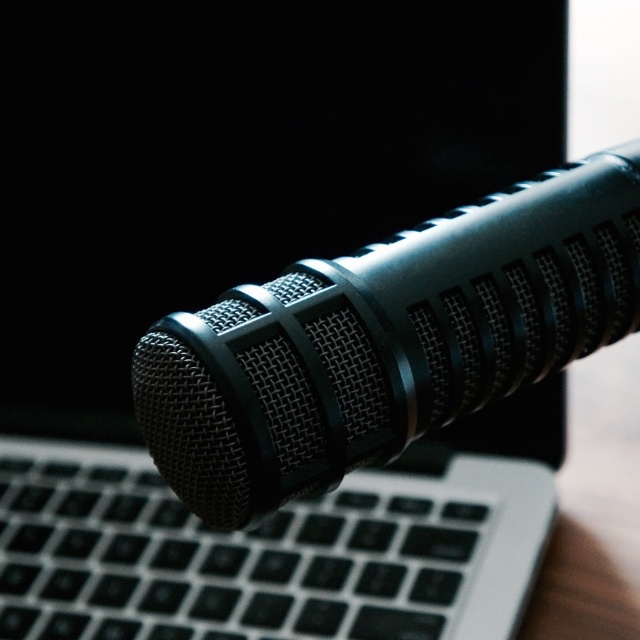
You are a photographer setting up for a product shoot. The black matte microphone at center needs to be positioned exactly 50 centimeters away from the camera to achieve the desired depth of field. Currently, it is placed at 67.66 centimeters. What adjustment should you make to the microphone to meet the required distance?

The black matte microphone at center is currently 67.66 centimeters away from the camera. To reach the desired 50 centimeters, you should move it closer to the camera by 17.66 centimeters.

You are setting up a home recording studio and need to ensure proper placement of your equipment. Given that you have a black matte microphone at center and a black matte keyboard at center, which object is placed above the other?

The black matte microphone at center is positioned over the black matte keyboard at center.

Where is the black matte microphone at center located in the image?

The black matte microphone at center is located at point coordinates of approximately 0.533 on the x axis and 0.606 on the y axis.